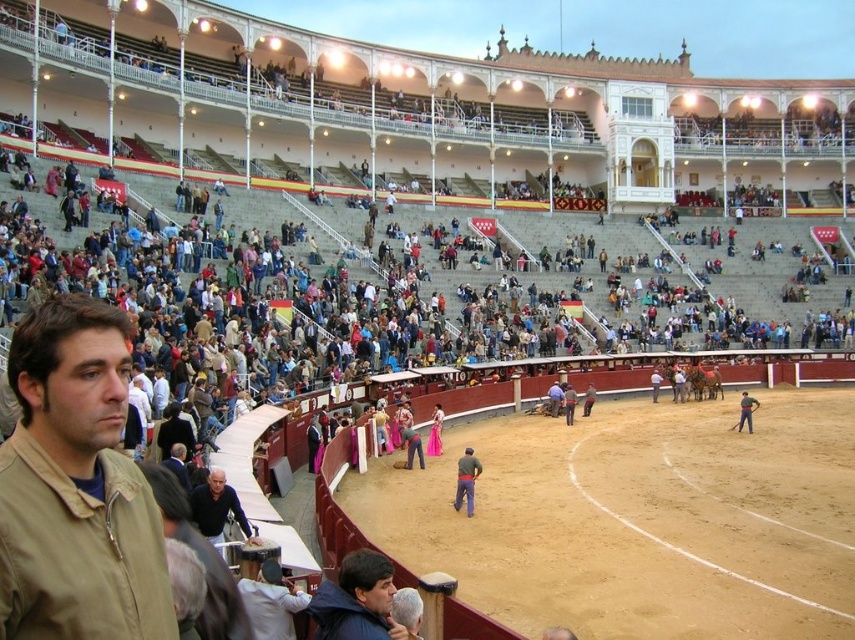
Between point (57, 522) and point (240, 520), which one is positioned behind?

The point (240, 520) is more distant.

Who is taller, brown fabric jacket at lower left or dark gray sweater at lower left?

With more height is brown fabric jacket at lower left.

Between point (74, 584) and point (252, 540), which one is positioned behind?

Positioned behind is point (252, 540).

The width and height of the screenshot is (855, 640). In order to click on brown fabric jacket at lower left in this screenshot , I will do `click(75, 486)`.

Is dark blue jacket at lower center below smooth leather jacket at center?

Yes, dark blue jacket at lower center is below smooth leather jacket at center.

Who is more distant from viewer, (335, 595) or (743, 400)?

Point (743, 400)

Which is behind, point (342, 579) or point (741, 397)?

The point (741, 397) is more distant.

You are a GUI agent. You are given a task and a screenshot of the screen. Output one action in this format:
    pyautogui.click(x=<x>, y=<y>)
    Task: Click on the dark blue jacket at lower center
    
    Given the screenshot: What is the action you would take?
    pyautogui.click(x=357, y=600)

Is brown fabric jacket at lower left smaller than smooth leather jacket at center?

Actually, brown fabric jacket at lower left might be larger than smooth leather jacket at center.

Does brown fabric jacket at lower left have a lesser height compared to smooth leather jacket at center?

In fact, brown fabric jacket at lower left may be taller than smooth leather jacket at center.

Find the location of a particular element. The width and height of the screenshot is (855, 640). brown fabric jacket at lower left is located at coordinates (75, 486).